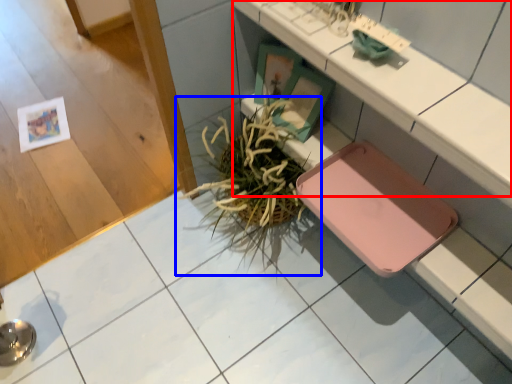
Question: Which point is further to the camera, counter (highlighted by a red box) or houseplant (highlighted by a blue box)?

Choices:
 (A) counter
 (B) houseplant

Answer: (B)